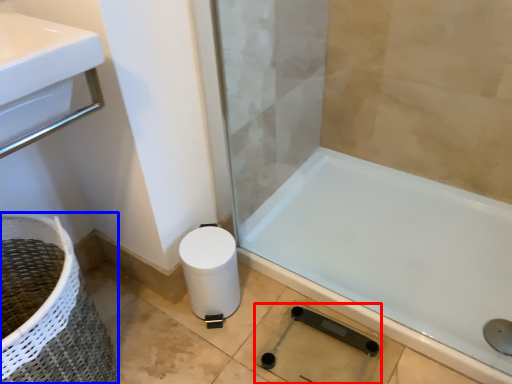
Question: Which object appears closest to the camera in this image, shower (highlighted by a red box) or basket container (highlighted by a blue box)?

Choices:
 (A) shower
 (B) basket container

Answer: (B)